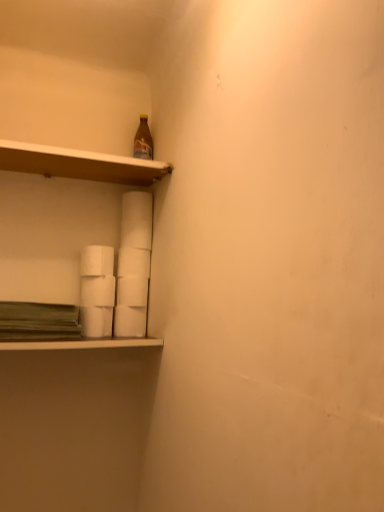
Where is `white matte paper towel at lower left, which ranks as the 6th paper towel in bottom-to-top order`? This screenshot has height=512, width=384. white matte paper towel at lower left, which ranks as the 6th paper towel in bottom-to-top order is located at coordinates (97, 261).

The image size is (384, 512). What do you see at coordinates (133, 262) in the screenshot?
I see `white matte paper towel at center, arranged as the 2th paper towel when viewed from the top` at bounding box center [133, 262].

At what (x,y) coordinates should I click in order to perform the action: click on white matte paper towel at center, the third paper towel viewed from the top. Please return your answer as a coordinate pair (x, y). The width and height of the screenshot is (384, 512). Looking at the image, I should click on (98, 291).

What is the approximate height of wooden shelf at upper left?

wooden shelf at upper left is 2.14 inches in height.

The image size is (384, 512). Find the location of `white matte paper towels at lower center`. white matte paper towels at lower center is located at coordinates 81,344.

What do you see at coordinates (81, 344) in the screenshot? Image resolution: width=384 pixels, height=512 pixels. I see `white matte paper towels at lower center` at bounding box center [81, 344].

You are a GUI agent. You are given a task and a screenshot of the screen. Output one action in this format:
    pyautogui.click(x=<x>, y=<y>)
    Task: Click on the white matte paper towel at lower center, which is the first paper towel in bottom-to-top order
    The height and width of the screenshot is (512, 384).
    Given the screenshot: What is the action you would take?
    pyautogui.click(x=130, y=321)

Does wooden shelf at upper left contain white matte paper towel at lower left, acting as the 1th paper towel starting from the top?

Definitely not — white matte paper towel at lower left, acting as the 1th paper towel starting from the top, is not inside wooden shelf at upper left.

Considering the positions of objects wooden shelf at upper left and white matte paper towel at lower left, which ranks as the 6th paper towel in bottom-to-top order, in the image provided, who is behind, wooden shelf at upper left or white matte paper towel at lower left, which ranks as the 6th paper towel in bottom-to-top order,?

white matte paper towel at lower left, which ranks as the 6th paper towel in bottom-to-top order, is further away from the camera.

Are wooden shelf at upper left and white matte paper towel at lower left, acting as the 1th paper towel starting from the top, far apart?

wooden shelf at upper left is actually quite close to white matte paper towel at lower left, acting as the 1th paper towel starting from the top.

Considering the points (95, 177) and (85, 256), which point is in front, point (95, 177) or point (85, 256)?

The point (85, 256) is closer to the camera.

Between point (135, 336) and point (137, 270), which one is positioned behind?

The point (137, 270) is farther from the camera.

Are white matte paper towel at lower center, the 6th paper towel from the top, and white matte paper towel at center, arranged as the 2th paper towel when viewed from the top, located far from each other?

white matte paper towel at lower center, the 6th paper towel from the top, is actually quite close to white matte paper towel at center, arranged as the 2th paper towel when viewed from the top.

Considering the sizes of objects white matte paper towel at lower center, which is the first paper towel in bottom-to-top order, and white matte paper towel at center, which is counted as the fifth paper towel, starting from the bottom, in the image provided, who is shorter, white matte paper towel at lower center, which is the first paper towel in bottom-to-top order, or white matte paper towel at center, which is counted as the fifth paper towel, starting from the bottom,?

With less height is white matte paper towel at center, which is counted as the fifth paper towel, starting from the bottom.

Is white matte paper towel at lower left, which ranks as the 6th paper towel in bottom-to-top order, oriented away from white matte paper towel at center, marked as the 4th paper towel in a bottom-to-top arrangement?

That's not correct — white matte paper towel at lower left, which ranks as the 6th paper towel in bottom-to-top order, is not looking away from white matte paper towel at center, marked as the 4th paper towel in a bottom-to-top arrangement.

Image resolution: width=384 pixels, height=512 pixels. Find the location of `the 1st paper towel to the right of the white matte paper towel at lower left, which ranks as the 6th paper towel in bottom-to-top order, starting your count from the anchor`. the 1st paper towel to the right of the white matte paper towel at lower left, which ranks as the 6th paper towel in bottom-to-top order, starting your count from the anchor is located at coordinates (98, 291).

Which of these two, white matte paper towel at lower left, which ranks as the 6th paper towel in bottom-to-top order, or white matte paper towel at center, the third paper towel viewed from the top, is thinner?

Thinner between the two is white matte paper towel at lower left, which ranks as the 6th paper towel in bottom-to-top order.

From the image's perspective, is white matte paper towel at lower left, acting as the 1th paper towel starting from the top, over white matte paper towel at center, marked as the 4th paper towel in a bottom-to-top arrangement?

Yes, from the image's perspective, white matte paper towel at lower left, acting as the 1th paper towel starting from the top, is over white matte paper towel at center, marked as the 4th paper towel in a bottom-to-top arrangement.

Based on their sizes in the image, would you say white matte paper towels at lower center is bigger or smaller than white matte paper towel at center, arranged as the 2th paper towel when viewed from the top?

In the image, white matte paper towels at lower center appears to be larger than white matte paper towel at center, arranged as the 2th paper towel when viewed from the top.

From a real-world perspective, is white matte paper towels at lower center positioned over white matte paper towel at center, arranged as the 2th paper towel when viewed from the top, based on gravity?

No, from a real-world perspective, white matte paper towels at lower center is not above white matte paper towel at center, arranged as the 2th paper towel when viewed from the top.

Is white matte paper towels at lower center thinner than white matte paper towel at center, which is counted as the fifth paper towel, starting from the bottom?

Incorrect, the width of white matte paper towels at lower center is not less than that of white matte paper towel at center, which is counted as the fifth paper towel, starting from the bottom.

Is point (86, 343) closer or farther from the camera than point (119, 267)?

Point (86, 343) appears to be closer to the viewer than point (119, 267).

Measure the distance from white matte paper towels at lower center to wooden shelf at upper left.

white matte paper towels at lower center is 53.75 centimeters away from wooden shelf at upper left.

Considering the relative sizes of white matte paper towels at lower center and wooden shelf at upper left in the image provided, is white matte paper towels at lower center thinner than wooden shelf at upper left?

Incorrect, the width of white matte paper towels at lower center is not less than that of wooden shelf at upper left.

Considering the relative sizes of white matte paper towels at lower center and wooden shelf at upper left in the image provided, is white matte paper towels at lower center shorter than wooden shelf at upper left?

Yes.

Is point (116, 341) in front of point (131, 170)?

Yes, point (116, 341) is closer to viewer.

Which of these two, white matte paper towel at center, marked as the 4th paper towel in a bottom-to-top arrangement, or white matte paper towel at lower left, acting as the 1th paper towel starting from the top, stands shorter?

Standing shorter between the two is white matte paper towel at center, marked as the 4th paper towel in a bottom-to-top arrangement.

From a real-world perspective, which is physically above, white matte paper towel at center, marked as the 4th paper towel in a bottom-to-top arrangement, or white matte paper towel at lower left, acting as the 1th paper towel starting from the top?

white matte paper towel at lower left, acting as the 1th paper towel starting from the top, is physically above.

Is point (102, 289) less distant than point (113, 255)?

Yes, point (102, 289) is in front of point (113, 255).

In order to click on the 2nd paper towel positioned above the white matte paper towel at center, marked as the 4th paper towel in a bottom-to-top arrangement (from the image's perspective) in this screenshot , I will do `click(97, 261)`.

Is white matte paper towel at lower left, which ranks as the 6th paper towel in bottom-to-top order, outside of white matte paper towels at lower center?

Yes, white matte paper towel at lower left, which ranks as the 6th paper towel in bottom-to-top order, is located beyond the bounds of white matte paper towels at lower center.

Which of these two, white matte paper towel at lower left, which ranks as the 6th paper towel in bottom-to-top order, or white matte paper towels at lower center, stands taller?

white matte paper towel at lower left, which ranks as the 6th paper towel in bottom-to-top order.

From the image's perspective, is white matte paper towel at lower left, which ranks as the 6th paper towel in bottom-to-top order, located above white matte paper towels at lower center?

Yes, from the image's perspective, white matte paper towel at lower left, which ranks as the 6th paper towel in bottom-to-top order, is over white matte paper towels at lower center.

Can you confirm if white matte paper towel at lower left, which ranks as the 6th paper towel in bottom-to-top order, is positioned to the left of white matte paper towels at lower center?

No, white matte paper towel at lower left, which ranks as the 6th paper towel in bottom-to-top order, is not to the left of white matte paper towels at lower center.

This screenshot has height=512, width=384. I want to click on the 1st paper towel positioned below the wooden shelf at upper left (from the image's perspective), so click(x=97, y=261).

From the image's perspective, starting from the white matte paper towel at lower center, the 6th paper towel from the top, which paper towel is the 4th one above? Please provide its 2D coordinates.

[(133, 262)]

Looking at the image, which one is located further to white matte paper towel at center, arranged as the 2th paper towel when viewed from the top, white matte paper towel at lower left, which ranks as the 6th paper towel in bottom-to-top order, or white matte paper towel at lower left, the 2th paper towel from the bottom?

white matte paper towel at lower left, the 2th paper towel from the bottom, lies further to white matte paper towel at center, arranged as the 2th paper towel when viewed from the top, than the other object.

Considering their positions, is white matte paper towel at lower left, the 2th paper towel from the bottom, positioned closer to wooden shelf at upper left than white matte paper towels at lower center?

white matte paper towel at lower left, the 2th paper towel from the bottom.

Based on their spatial positions, is white matte paper towel at center, which is counted as the fifth paper towel, starting from the bottom, or white matte paper towels at lower center closer to white matte paper towel at lower left, the 2th paper towel from the bottom?

white matte paper towels at lower center is positioned closer to the anchor white matte paper towel at lower left, the 2th paper towel from the bottom.

Estimate the real-world distances between objects in this image. Which object is closer to white matte paper towel at lower center, which is the first paper towel in bottom-to-top order, wooden shelf at upper left or white matte paper towel at center, arranged as the 2th paper towel when viewed from the top?

white matte paper towel at center, arranged as the 2th paper towel when viewed from the top, is closer to white matte paper towel at lower center, which is the first paper towel in bottom-to-top order.

From the image, which object appears to be farther from white matte paper towel at center, the third paper towel viewed from the top, white matte paper towels at lower center or wooden shelf at upper left?

Based on the image, wooden shelf at upper left appears to be further to white matte paper towel at center, the third paper towel viewed from the top.

Which object lies nearer to the anchor point wooden shelf at upper left, white matte paper towels at lower center or white matte paper towel at center, placed as the third paper towel when sorted from bottom to top?

white matte paper towel at center, placed as the third paper towel when sorted from bottom to top, is closer to wooden shelf at upper left.

Based on their spatial positions, is wooden shelf at upper left or white matte paper towel at lower center, which is the first paper towel in bottom-to-top order, closer to white matte paper towel at center, the fourth paper towel from the top?

Based on the image, white matte paper towel at lower center, which is the first paper towel in bottom-to-top order, appears to be nearer to white matte paper towel at center, the fourth paper towel from the top.

Looking at the image, which one is located closer to white matte paper towel at center, placed as the third paper towel when sorted from bottom to top, white matte paper towel at lower left, the 2th paper towel from the bottom, or white matte paper towels at lower center?

white matte paper towel at lower left, the 2th paper towel from the bottom.

In order to click on paper towel located between white matte paper towels at lower center and white matte paper towel at center, marked as the 4th paper towel in a bottom-to-top arrangement, in the depth direction in this screenshot , I will do `click(96, 321)`.

I want to click on paper towel between wooden shelf at upper left and white matte paper towel at center, arranged as the 2th paper towel when viewed from the top, vertically, so click(x=97, y=261).